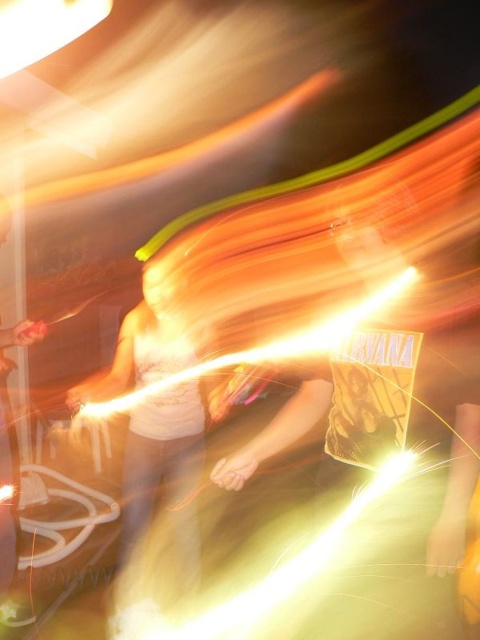
You are standing at the center of the scene and want to move towards the point that is closer to you. Which point should you move towards, point (162, 448) or point (7, 561)?

You should move towards point (162, 448) because it is in front of point (7, 561), meaning it is closer to your current position.